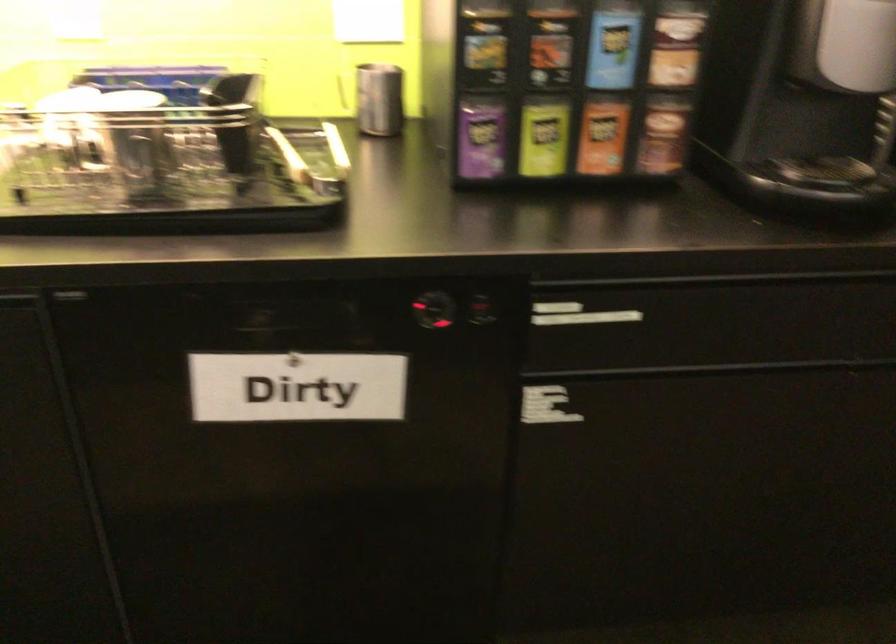
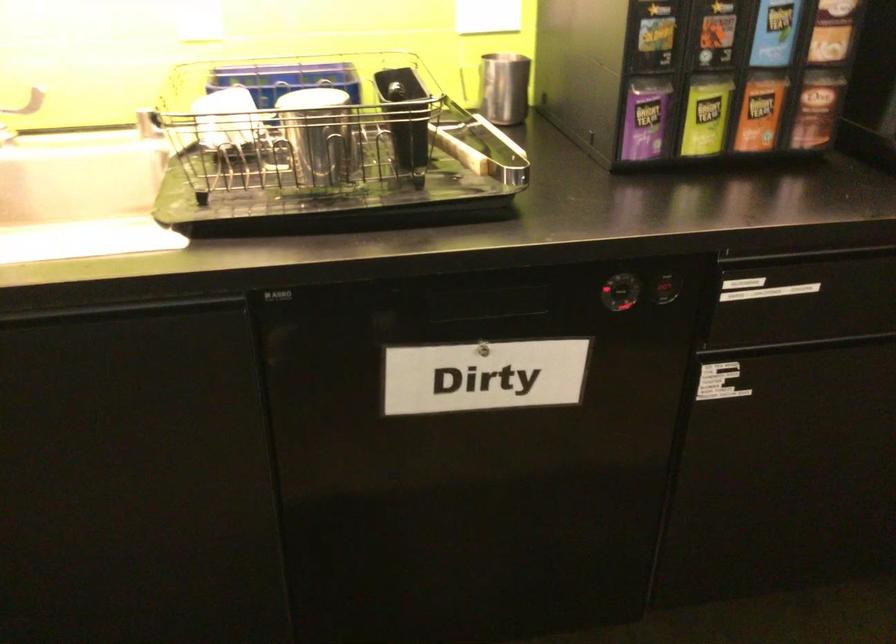
Where in the second image is the point corresponding to (133,138) from the first image?

(319, 134)